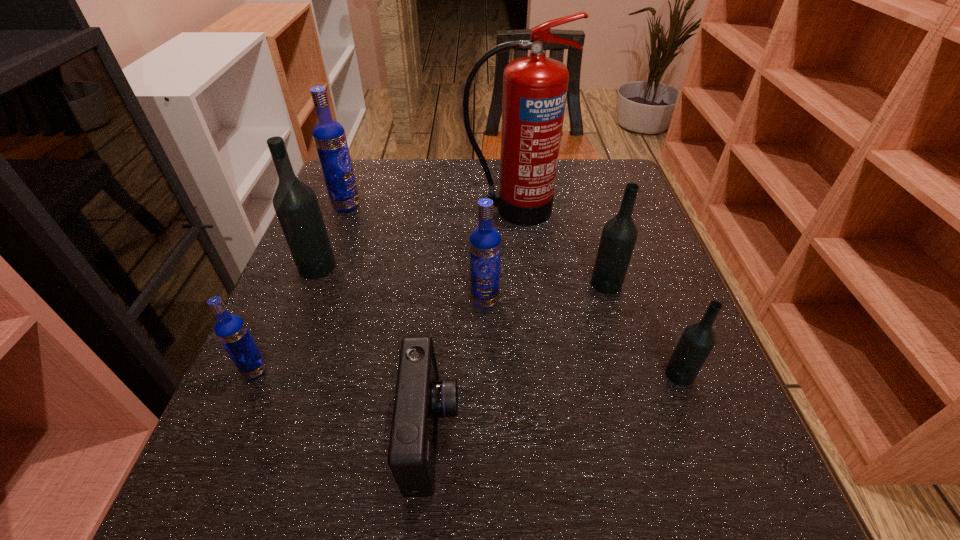
The height and width of the screenshot is (540, 960). I want to click on vacant space positioned 0.140m on the back of the rightmost vodka, so click(x=653, y=305).

Locate an element on the screen. This screenshot has width=960, height=540. vacant space located 0.260m on the front-facing side of the blue camera is located at coordinates (625, 435).

Find the location of a particular element. The height and width of the screenshot is (540, 960). fire extinguisher that is at the far edge is located at coordinates (535, 87).

Identify the location of vodka present at the far edge. (329, 137).

The height and width of the screenshot is (540, 960). Identify the location of object that is at the near edge. (421, 398).

Where is `object at the far left corner`? This screenshot has width=960, height=540. object at the far left corner is located at coordinates (329, 137).

Image resolution: width=960 pixels, height=540 pixels. In the image, there is a desktop. Identify the location of free space at the far edge. (417, 159).

I want to click on vacant space at the near edge of the desktop, so click(352, 516).

In the image, there is a desktop. Identify the location of vacant space at the left edge. This screenshot has height=540, width=960. (321, 298).

In the image, there is a desktop. What are the coordinates of `vacant space at the right edge` in the screenshot? It's located at (708, 364).